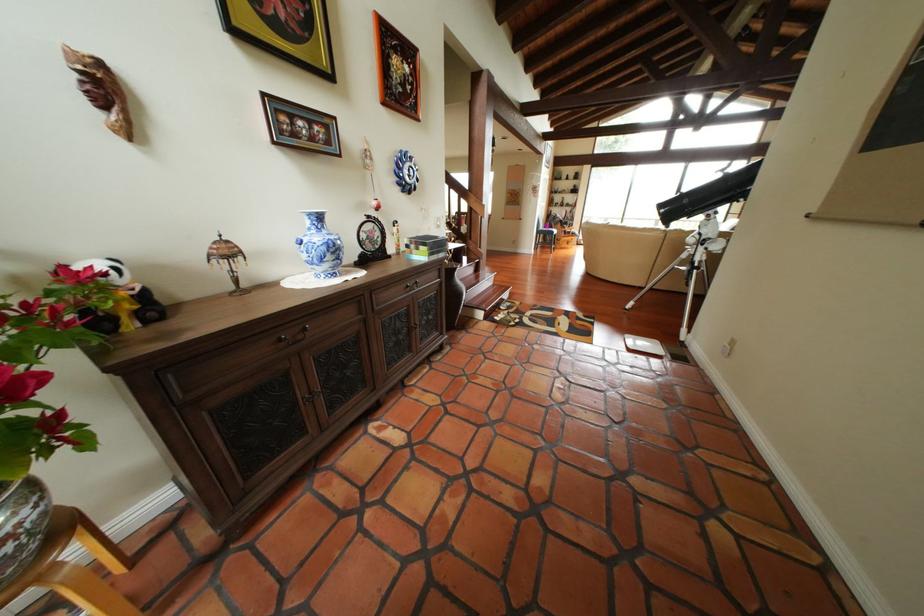
Which object does [21,524] point to?

It refers to a dark floor vase.